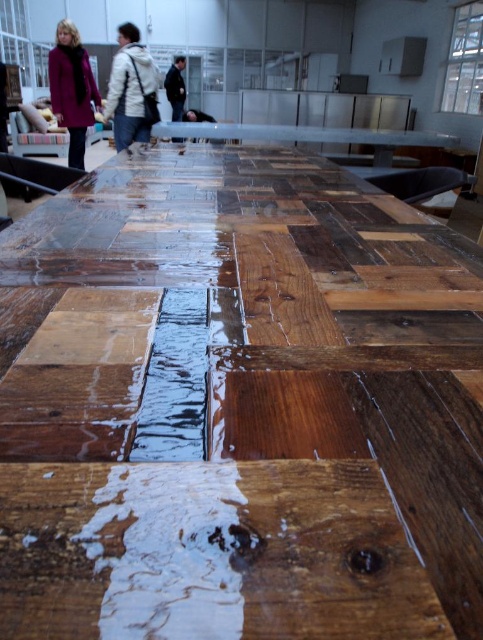
You are organizing a clothing display at a store and need to place the matte purple coat at left and the dark blue jacket at center on a shelf. The shelf has limited space. Which item should you prioritize placing first to ensure both fit?

The matte purple coat at left is larger in size than the dark blue jacket at center, so you should prioritize placing the matte purple coat at left first to accommodate its larger size before placing the smaller dark blue jacket at center.

You are organizing a clothing display at a store and need to place the matte purple coat at left and the dark blue jacket at center on a shelf. The shelf has limited space. Which item should you place first to ensure both fit properly?

Result: The matte purple coat at left has a lesser width compared to the dark blue jacket at center, so you should place the dark blue jacket at center first to accommodate its larger size and then fit the smaller matte purple coat at left alongside it.

You are a customer in a clothing store and see the matte purple coat at left and the dark blue jacket at center. Which one is taller?

The matte purple coat at left is taller than the dark blue jacket at center.